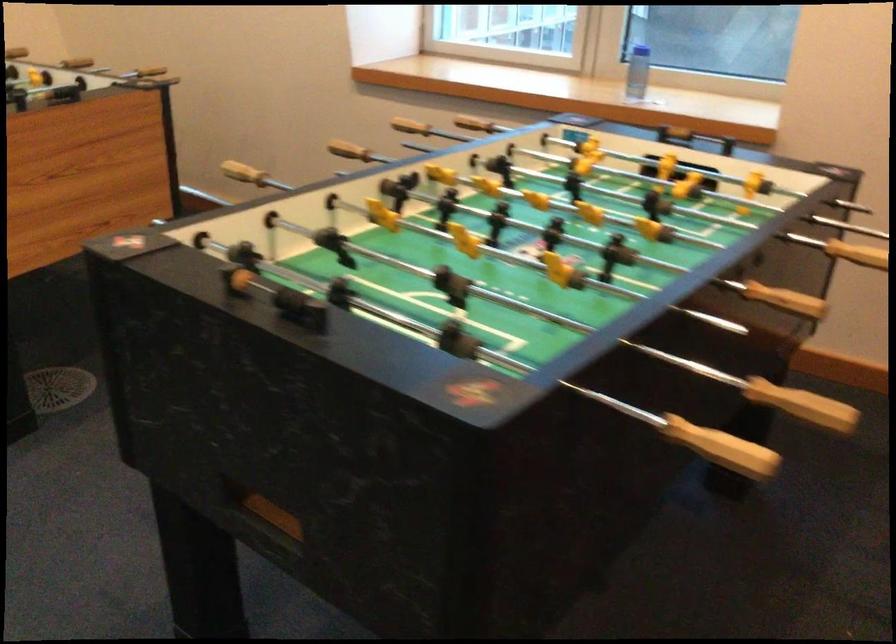
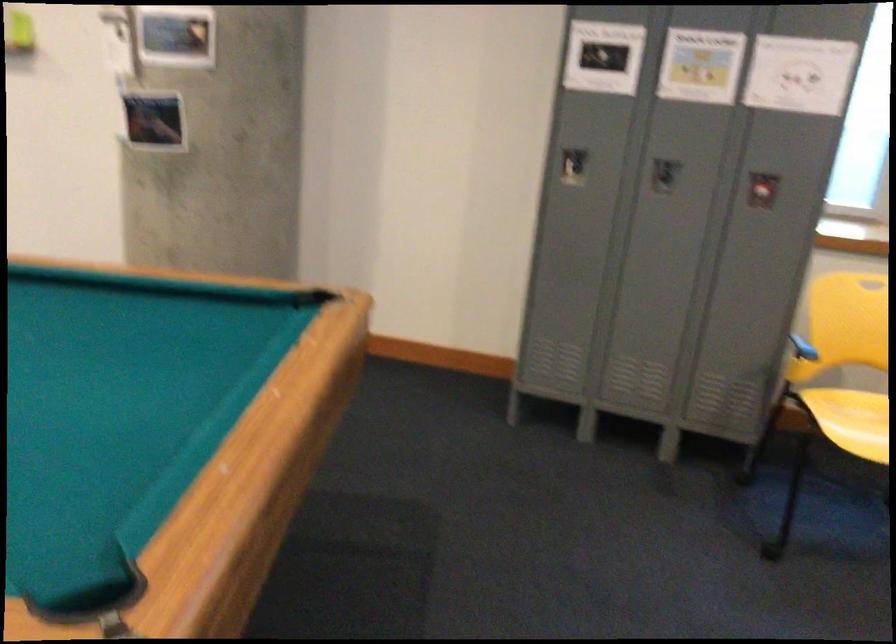
Question: The camera is either moving clockwise (left) or counter-clockwise (right) around the object. The first image is from the beginning of the video and the second image is from the end. Is the camera moving left or right when shooting the video?

Choices:
 (A) Left
 (B) Right

Answer: (B)